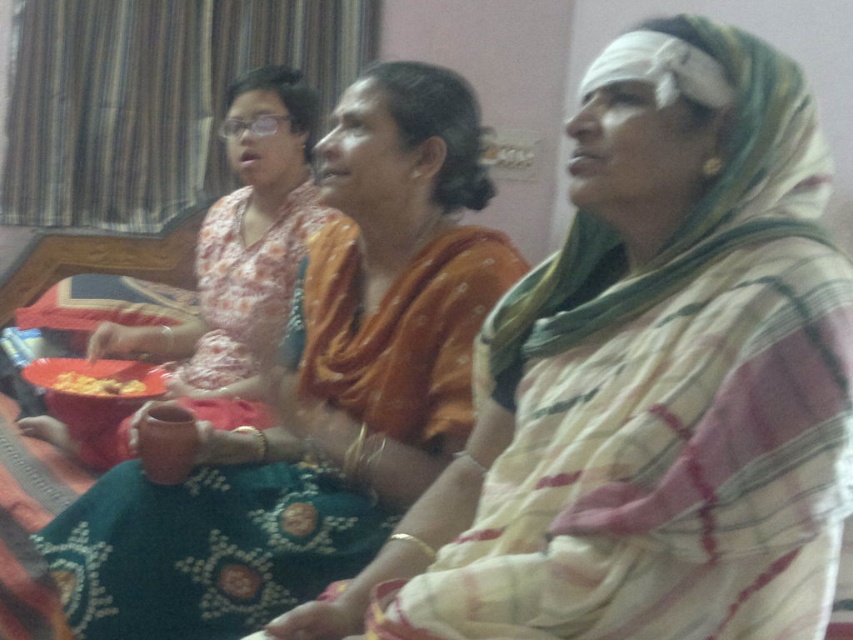
Can you confirm if matte orange bowl at center is positioned to the right of yellow crispy snack at lower left?

Indeed, matte orange bowl at center is positioned on the right side of yellow crispy snack at lower left.

What do you see at coordinates (241, 240) in the screenshot? This screenshot has height=640, width=853. I see `matte orange bowl at center` at bounding box center [241, 240].

Locate an element on the screen. The image size is (853, 640). matte orange bowl at center is located at coordinates (241, 240).

Can you confirm if matte brown bowl at center is smaller than matte orange bowl at center?

Yes, matte brown bowl at center is smaller than matte orange bowl at center.

Which is in front, point (308, 403) or point (254, 173)?

Point (308, 403) is in front.

Between point (105, 524) and point (291, 141), which one is positioned behind?

Point (291, 141)

Where is `matte brown bowl at center`? The width and height of the screenshot is (853, 640). matte brown bowl at center is located at coordinates (317, 390).

Is point (448, 70) less distant than point (74, 388)?

No.

Who is taller, matte brown bowl at center or yellow crispy snack at lower left?

matte brown bowl at center is taller.

The height and width of the screenshot is (640, 853). What do you see at coordinates (317, 390) in the screenshot?
I see `matte brown bowl at center` at bounding box center [317, 390].

The image size is (853, 640). What are the coordinates of `matte brown bowl at center` in the screenshot? It's located at (317, 390).